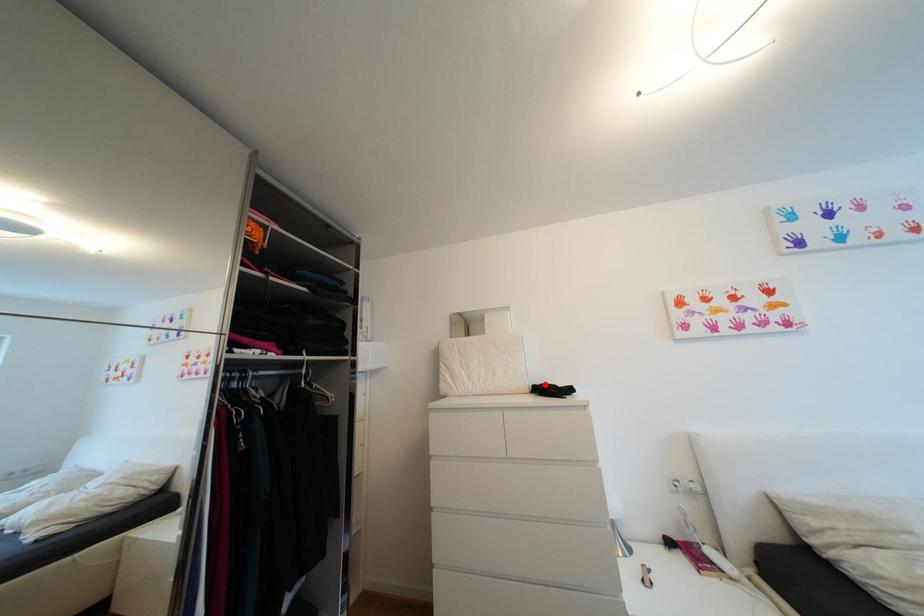
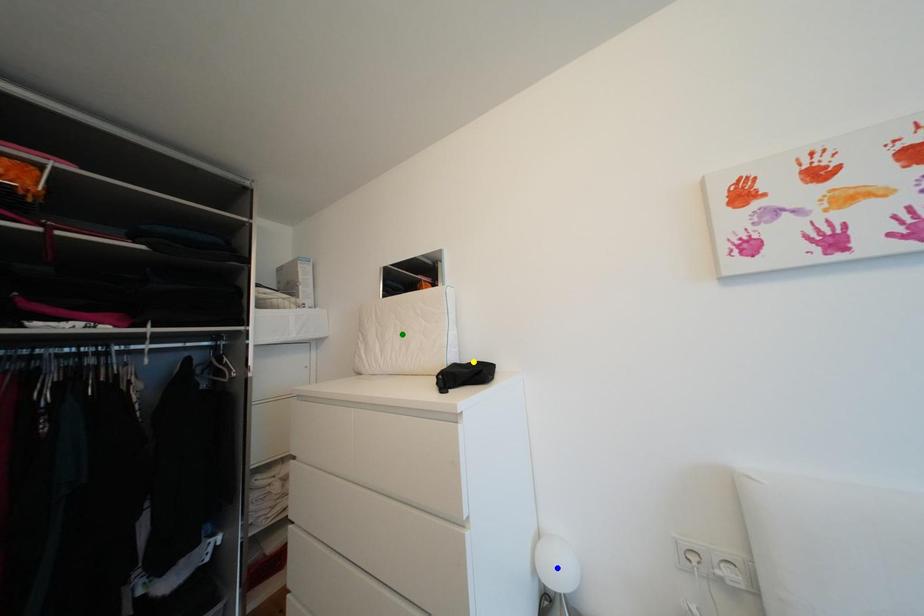
Question: I am providing you with two images of the same scene from different viewpoints. A red point is marked on the first image. You are given multiple points on the second image. Which spot in image 2 lines up with the point in image 1?

Choices:
 (A) yellow point
 (B) green point
 (C) blue point

Answer: (A)